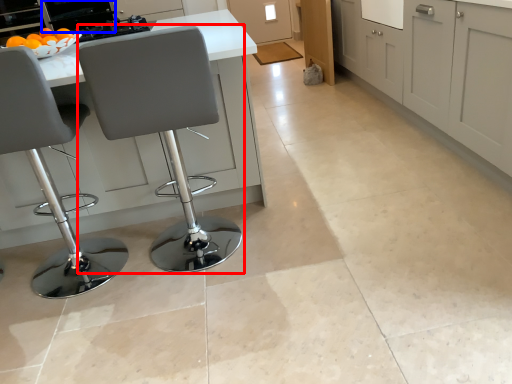
Question: Among these objects, which one is nearest to the camera, chair (highlighted by a red box) or appliance (highlighted by a blue box)?

Choices:
 (A) chair
 (B) appliance

Answer: (A)